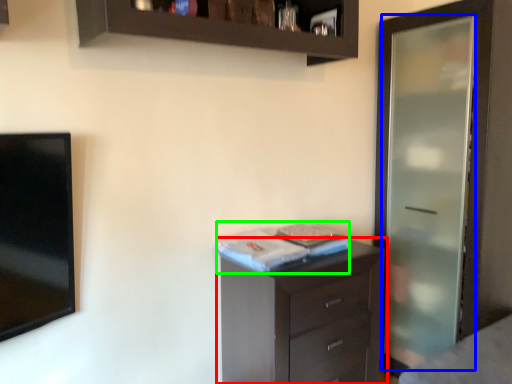
Question: Which object is the farthest from chest of drawers (highlighted by a red box)? Choose among these: screen door (highlighted by a blue box) or book (highlighted by a green box).

Choices:
 (A) screen door
 (B) book

Answer: (A)